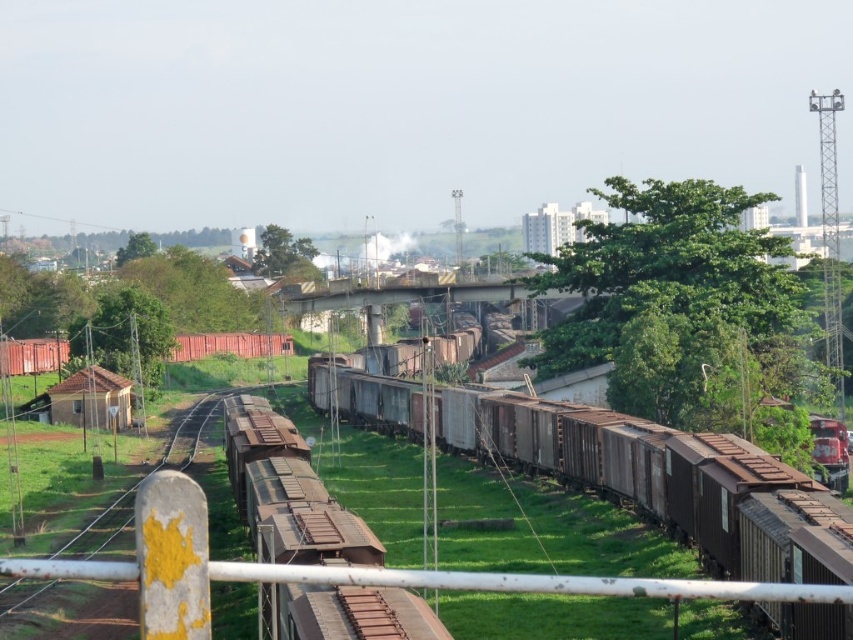
Question: Is rusty metal train car at center smaller than green leafy tree at upper left?

Choices:
 (A) yes
 (B) no

Answer: (A)

Question: Is green leafy tree at upper center above green leafy tree at upper left?

Choices:
 (A) no
 (B) yes

Answer: (A)

Question: Which object appears closest to the camera in this image?

Choices:
 (A) green leafy tree at upper left
 (B) rusty metal train carriages at center
 (C) rusty metal rail at center
 (D) green leafy tree at upper center

Answer: (C)

Question: Which point appears farthest from the camera in this image?

Choices:
 (A) (115, 264)
 (B) (376, 573)
 (C) (677, 465)
 (D) (264, 490)

Answer: (A)

Question: Which point is closer to the camera?

Choices:
 (A) (276, 266)
 (B) (619, 244)
 (C) (763, 600)

Answer: (C)

Question: Where is rusty metal train carriages at center located in relation to green leafy tree at upper left in the image?

Choices:
 (A) right
 (B) left

Answer: (A)